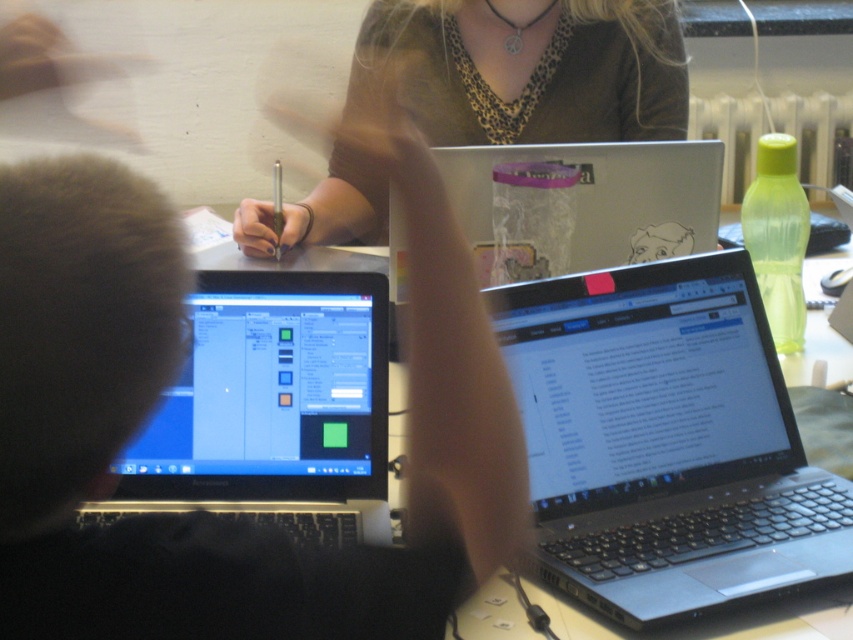
Question: Does matte black laptop at upper center have a greater width compared to matte black laptop at center?

Choices:
 (A) yes
 (B) no

Answer: (A)

Question: Which point is farther to the camera?

Choices:
 (A) black matte laptop at left
 (B) matte black laptop at upper center

Answer: (B)

Question: Is black matte laptop at left above black matte laptop at center?

Choices:
 (A) yes
 (B) no

Answer: (A)

Question: Is black matte laptop at left positioned at the back of black matte laptop at center?

Choices:
 (A) yes
 (B) no

Answer: (B)

Question: Which of these objects is positioned closest to the matte black laptop at upper center?

Choices:
 (A) matte black laptop at center
 (B) black matte laptop at left

Answer: (A)

Question: Which object is positioned farthest from the black matte laptop at center?

Choices:
 (A) matte black laptop at upper center
 (B) matte black laptop at center
 (C) black matte laptop at left

Answer: (A)